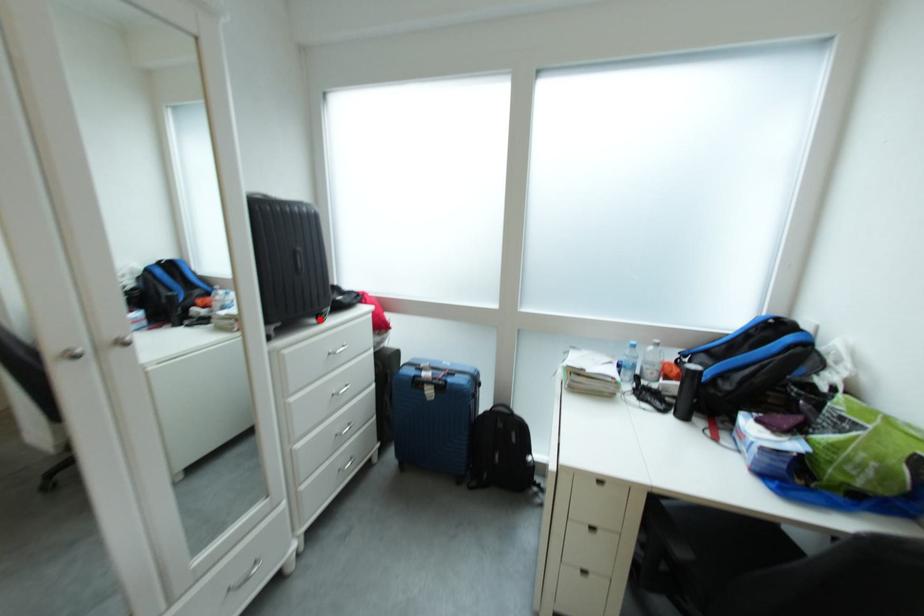
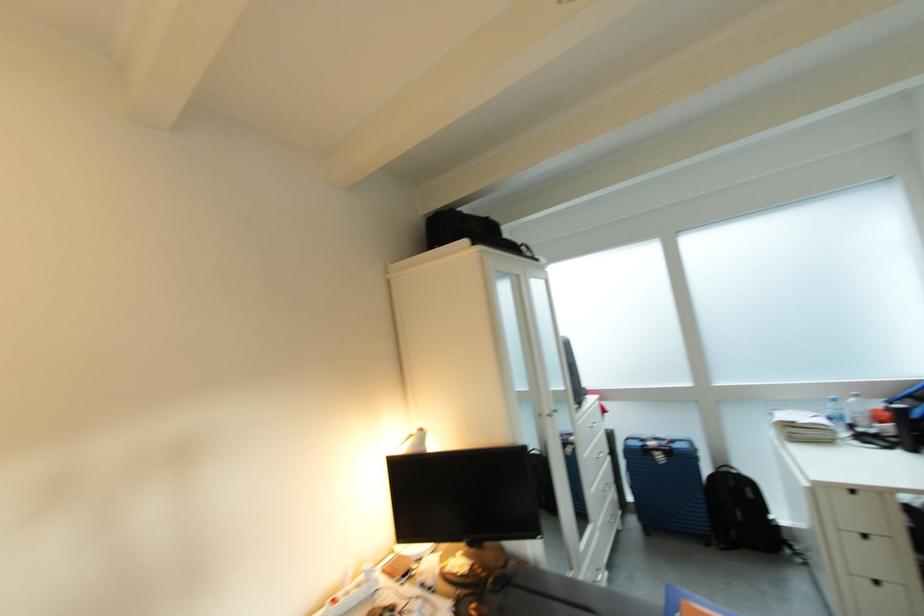
Question: I am providing you with two images of the same scene from different viewpoints. A red point is marked on the first image. At the location where the point appears in image 1, is it still visible in image 2?

Choices:
 (A) Yes
 (B) No

Answer: (B)